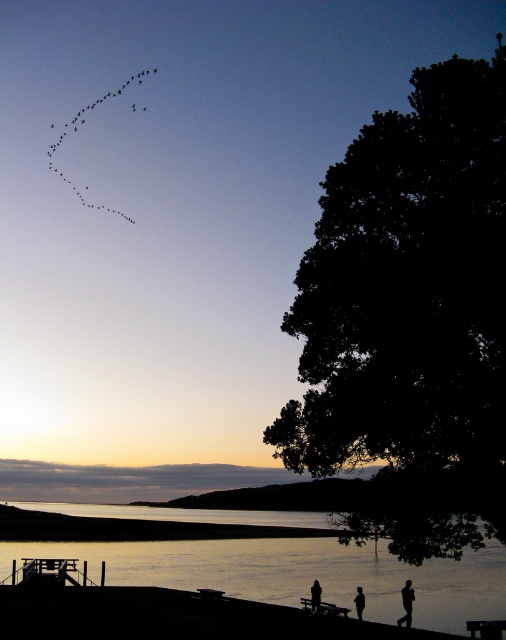
Between point (378, 529) and point (320, 588), which one is positioned in front?

Point (378, 529) is more forward.

Is dark silhouette tree at right thinner than black matte person at lower center?

Incorrect, dark silhouette tree at right's width is not less than black matte person at lower center's.

Which is in front, point (424, 522) or point (316, 588)?

Point (424, 522) is in front.

Where is `dark silhouette tree at right`? dark silhouette tree at right is located at coordinates (410, 317).

Does silhouette running man at lower right have a greater width compared to black matte person at lower center?

Yes.

Is point (410, 589) less distant than point (316, 598)?

Yes, point (410, 589) is in front of point (316, 598).

At what (x,y) coordinates should I click in order to perform the action: click on silhouette running man at lower right. Please return your answer as a coordinate pair (x, y). The height and width of the screenshot is (640, 506). Looking at the image, I should click on (406, 604).

Is dark silhouette tree at right to the left of black matte birds at upper left from the viewer's perspective?

In fact, dark silhouette tree at right is to the right of black matte birds at upper left.

Is dark silhouette tree at right smaller than black matte birds at upper left?

Actually, dark silhouette tree at right might be larger than black matte birds at upper left.

Which is behind, point (374, 531) or point (56, 170)?

Point (56, 170)

Identify the location of dark silhouette tree at right. This screenshot has width=506, height=640. (410, 317).